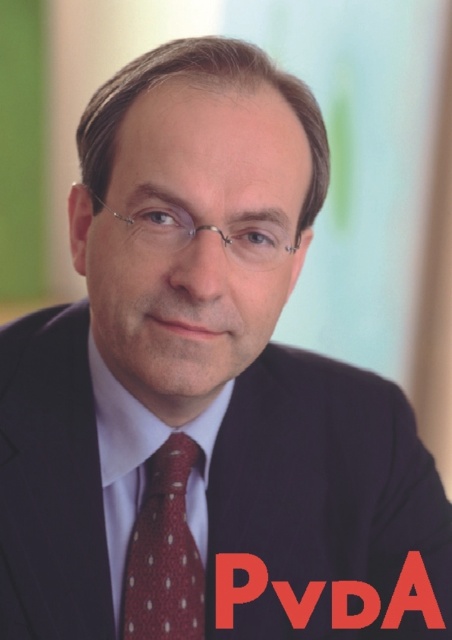
Which is more to the left, red dotted tie at center or white smooth dress shirt at center?

white smooth dress shirt at center is more to the left.

Who is more forward, (142,548) or (108,536)?

Positioned in front is point (142,548).

Who is more distant from viewer, (175, 513) or (155, 428)?

The point (175, 513) is behind.

Find the location of `red dotted tie at center`. red dotted tie at center is located at coordinates (164, 554).